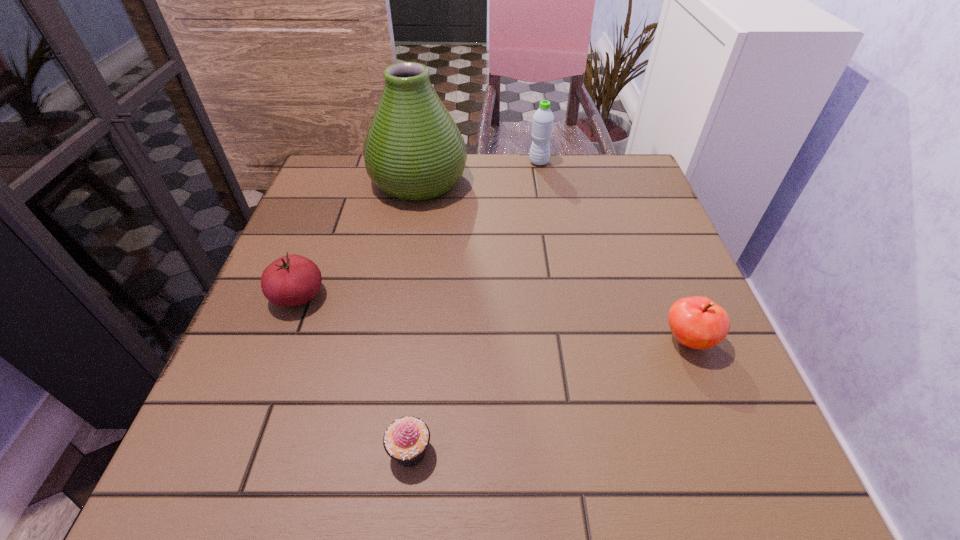
At what (x,y) coordinates should I click in order to perform the action: click on vacant point that satisfies the following two spatial constraints: 1. on the back side of the nearest object; 2. on the right side of the water bottle. Please return your answer as a coordinate pair (x, y). Looking at the image, I should click on (443, 162).

Where is `vacant area in the image that satisfies the following two spatial constraints: 1. on the front side of the rightmost object; 2. on the right side of the fourth shortest object`? The height and width of the screenshot is (540, 960). vacant area in the image that satisfies the following two spatial constraints: 1. on the front side of the rightmost object; 2. on the right side of the fourth shortest object is located at coordinates (569, 340).

You are a GUI agent. You are given a task and a screenshot of the screen. Output one action in this format:
    pyautogui.click(x=<x>, y=<y>)
    Task: Click on the free spot that satisfies the following two spatial constraints: 1. on the front side of the vase; 2. on the left side of the cupcake
    
    Given the screenshot: What is the action you would take?
    pyautogui.click(x=373, y=451)

The image size is (960, 540). I want to click on vacant region that satisfies the following two spatial constraints: 1. on the back side of the water bottle; 2. on the right side of the nearest object, so click(443, 162).